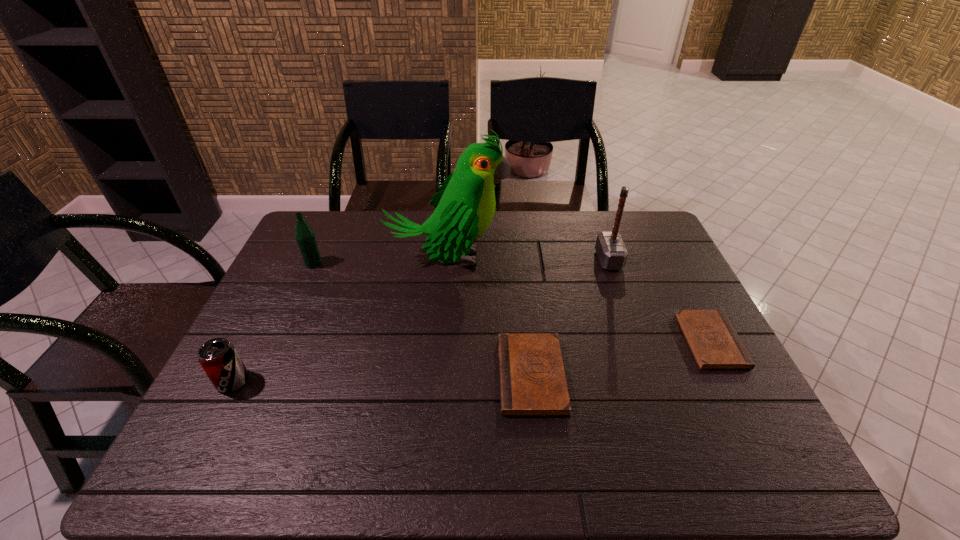
You are a GUI agent. You are given a task and a screenshot of the screen. Output one action in this format:
    pyautogui.click(x=<x>, y=<y>)
    Task: Click on the taller diary
    
    Given the screenshot: What is the action you would take?
    [532, 380]

You are a GUI agent. You are given a task and a screenshot of the screen. Output one action in this format:
    pyautogui.click(x=<x>, y=<y>)
    Task: Click on the left diary
    This screenshot has height=540, width=960.
    Given the screenshot: What is the action you would take?
    [532, 380]

Find the location of a particular element. This screenshot has width=960, height=540. the shortest object is located at coordinates pos(713,341).

The image size is (960, 540). In order to click on the right diary in this screenshot , I will do `click(713, 341)`.

I want to click on the fifth shortest object, so click(x=611, y=251).

What are the coordinates of `the second object from right to left` in the screenshot? It's located at (611, 251).

The width and height of the screenshot is (960, 540). I want to click on parakeet, so click(x=465, y=204).

Identify the location of the fifth object from right to left. (304, 234).

This screenshot has width=960, height=540. I want to click on bottle, so click(304, 234).

This screenshot has width=960, height=540. In order to click on the third shortest object in this screenshot , I will do `click(218, 357)`.